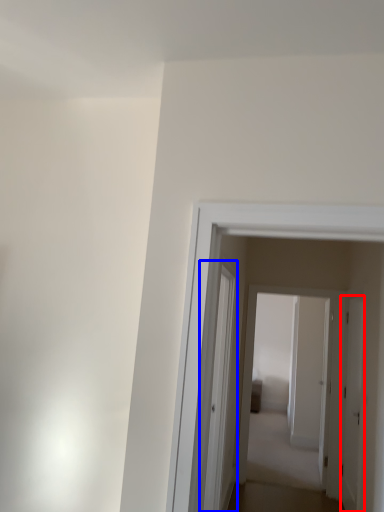
Question: Which point is further to the camera, door (highlighted by a red box) or glass door (highlighted by a blue box)?

Choices:
 (A) door
 (B) glass door

Answer: (A)